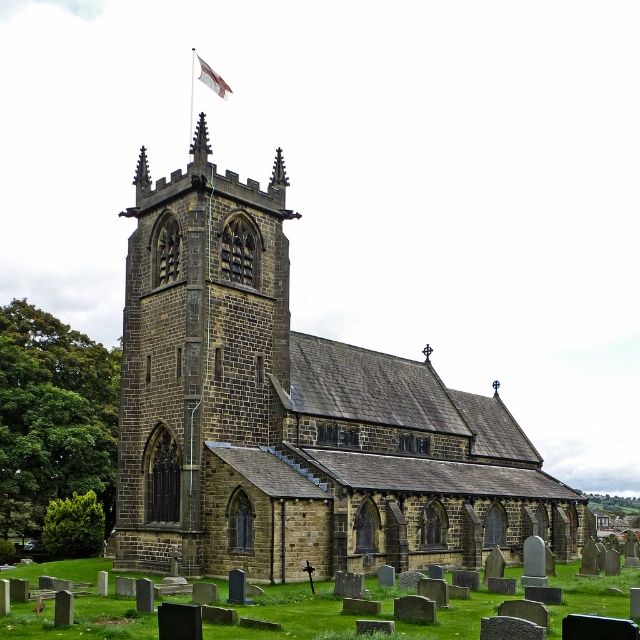
Can you confirm if brown stone tower at center is bigger than white fabric flag at upper center?

Incorrect, brown stone tower at center is not larger than white fabric flag at upper center.

Is the position of brown stone tower at center more distant than that of white fabric flag at upper center?

No, it is in front of white fabric flag at upper center.

Describe the element at coordinates (202, 369) in the screenshot. The image size is (640, 640). I see `brown stone tower at center` at that location.

Identify the location of brown stone tower at center. The image size is (640, 640). (202, 369).

Can you confirm if brown stone church at center is bigger than white fabric flag at upper center?

Yes, brown stone church at center is bigger than white fabric flag at upper center.

How much distance is there between brown stone church at center and white fabric flag at upper center?

brown stone church at center is 38.05 meters away from white fabric flag at upper center.

Image resolution: width=640 pixels, height=640 pixels. What are the coordinates of `brown stone church at center` in the screenshot? It's located at (292, 413).

Measure the distance between brown stone church at center and camera.

58.89 meters

Which of these two, brown stone church at center or brown stone tower at center, stands shorter?

With less height is brown stone tower at center.

Is point (234, 182) less distant than point (125, 323)?

Yes.

The width and height of the screenshot is (640, 640). I want to click on brown stone church at center, so click(292, 413).